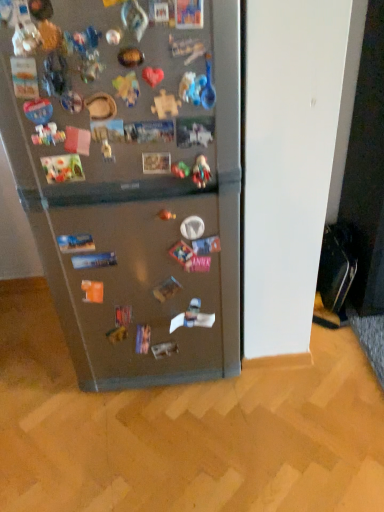
Question: Is satin metallic refrigerator at center at the left side of plastic toy at center?

Choices:
 (A) yes
 (B) no

Answer: (A)

Question: Considering the relative sizes of satin metallic refrigerator at center and plastic toy at center in the image provided, is satin metallic refrigerator at center taller than plastic toy at center?

Choices:
 (A) yes
 (B) no

Answer: (A)

Question: Is satin metallic refrigerator at center in contact with plastic toy at center?

Choices:
 (A) no
 (B) yes

Answer: (A)

Question: Does satin metallic refrigerator at center have a smaller size compared to plastic toy at center?

Choices:
 (A) yes
 (B) no

Answer: (B)

Question: Can you confirm if satin metallic refrigerator at center is positioned to the right of plastic toy at center?

Choices:
 (A) no
 (B) yes

Answer: (A)

Question: Is satin metallic refrigerator at center facing towards plastic toy at center?

Choices:
 (A) no
 (B) yes

Answer: (B)

Question: Is plastic toy at center oriented towards satin metallic refrigerator at center?

Choices:
 (A) no
 (B) yes

Answer: (B)

Question: From a real-world perspective, is plastic toy at center under satin metallic refrigerator at center?

Choices:
 (A) yes
 (B) no

Answer: (B)

Question: Is plastic toy at center at the right side of satin metallic refrigerator at center?

Choices:
 (A) yes
 (B) no

Answer: (A)

Question: Is plastic toy at center closer to camera compared to satin metallic refrigerator at center?

Choices:
 (A) no
 (B) yes

Answer: (A)

Question: Can you confirm if plastic toy at center is thinner than satin metallic refrigerator at center?

Choices:
 (A) no
 (B) yes

Answer: (B)

Question: Considering the relative positions of plastic toy at center and satin metallic refrigerator at center in the image provided, is plastic toy at center to the left of satin metallic refrigerator at center from the viewer's perspective?

Choices:
 (A) yes
 (B) no

Answer: (B)

Question: Relative to satin metallic refrigerator at center, is plastic toy at center in front or behind?

Choices:
 (A) behind
 (B) front

Answer: (A)